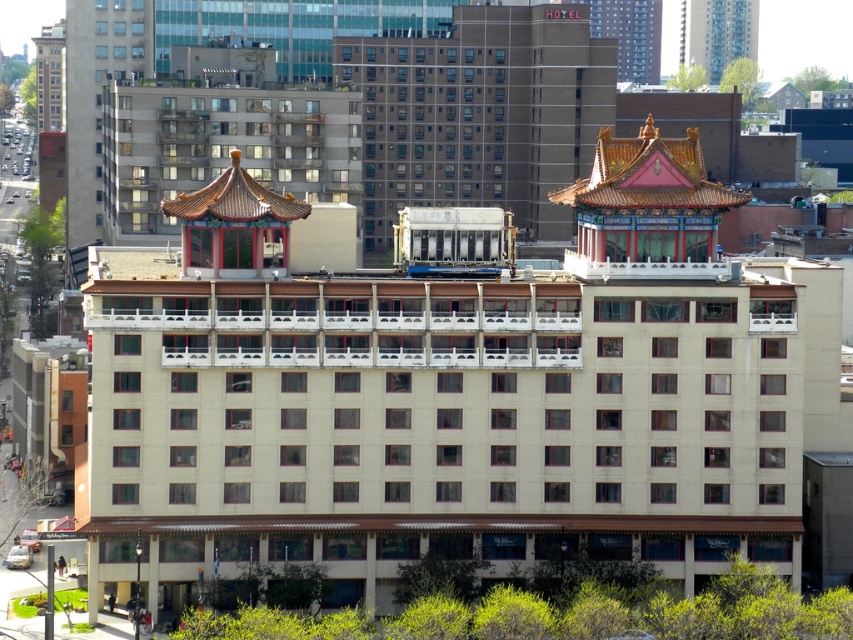
Can you confirm if white matte building at center is positioned above beige concrete hotel at center?

No, white matte building at center is not above beige concrete hotel at center.

Between white matte building at center and beige concrete hotel at center, which one appears on the right side from the viewer's perspective?

white matte building at center is more to the right.

Describe the element at coordinates (459, 390) in the screenshot. I see `white matte building at center` at that location.

The image size is (853, 640). In order to click on white matte building at center in this screenshot , I will do `click(459, 390)`.